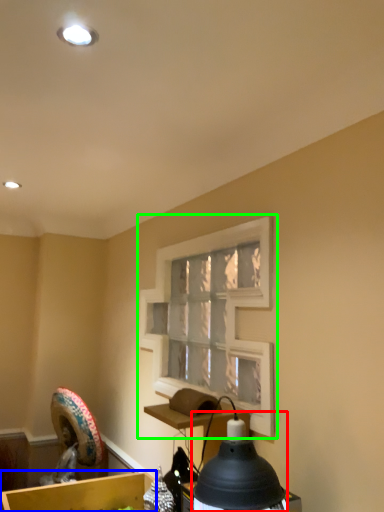
Question: Which object is positioned farthest from lamp (highlighted by a red box)? Select from cardboard box (highlighted by a blue box) and window frame (highlighted by a green box).

Choices:
 (A) cardboard box
 (B) window frame

Answer: (A)